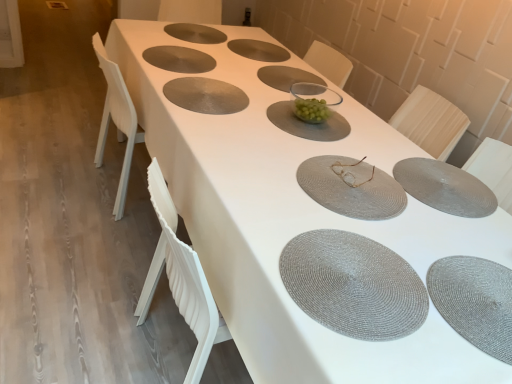
Where is `vacant area that lies between gray woven placemat at center and gray woven placemat at lower right, the 1th tableware from the bottom`? vacant area that lies between gray woven placemat at center and gray woven placemat at lower right, the 1th tableware from the bottom is located at coordinates (422, 291).